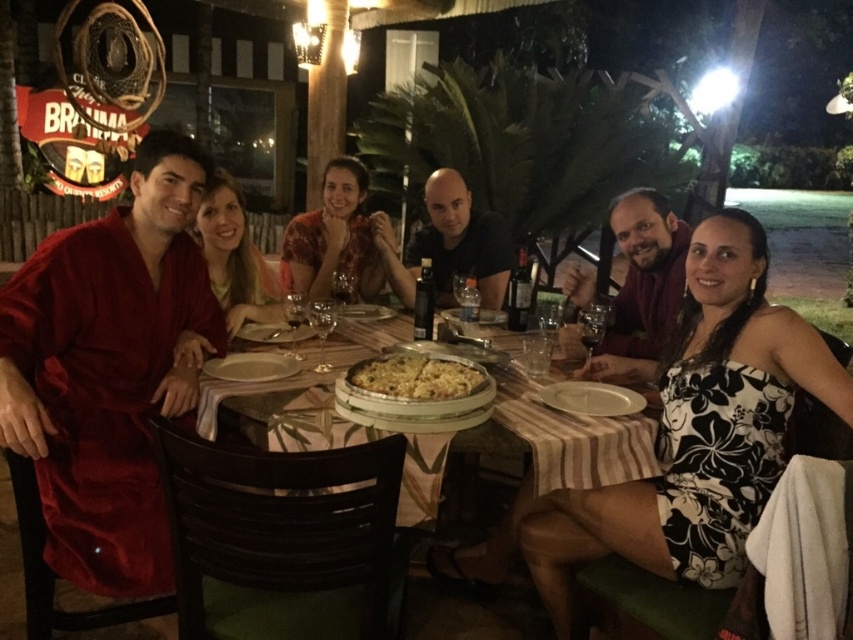
From the picture: You are a photographer taking a group photo of the people at the table. You want to position yourself so that the black floral dress at center and the matte red robe at upper left are both clearly visible in the frame. Based on their positions, which side of the table should you stand to ensure both are in the shot?

You should stand to the right side of the table because the black floral dress at center is to the right of the matte red robe at upper left, so positioning yourself on the right will keep both in the frame without one blocking the other.

You are a photographer setting up for a group photo at the round table. You need to ensure that the black floral dress at center and the matte red robe at upper left are both visible in the frame. Given their heights, which one might require you to adjust your camera angle to avoid being obscured?

The black floral dress at center has a greater height compared to the matte red robe at upper left, so you might need to lower the camera angle to ensure the taller black floral dress at center does not block the view of the shorter matte red robe at upper left.